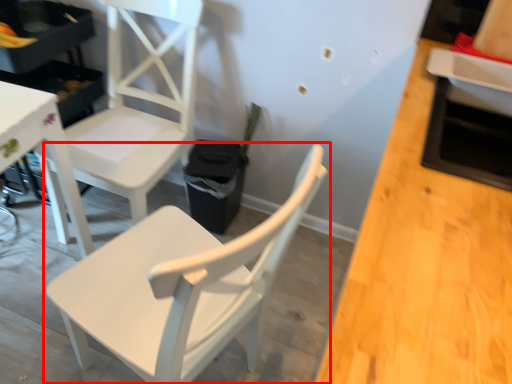
Question: Considering the relative positions of chair (annotated by the red box) and chair in the image provided, where is chair (annotated by the red box) located with respect to the staircase?

Choices:
 (A) left
 (B) right

Answer: (B)